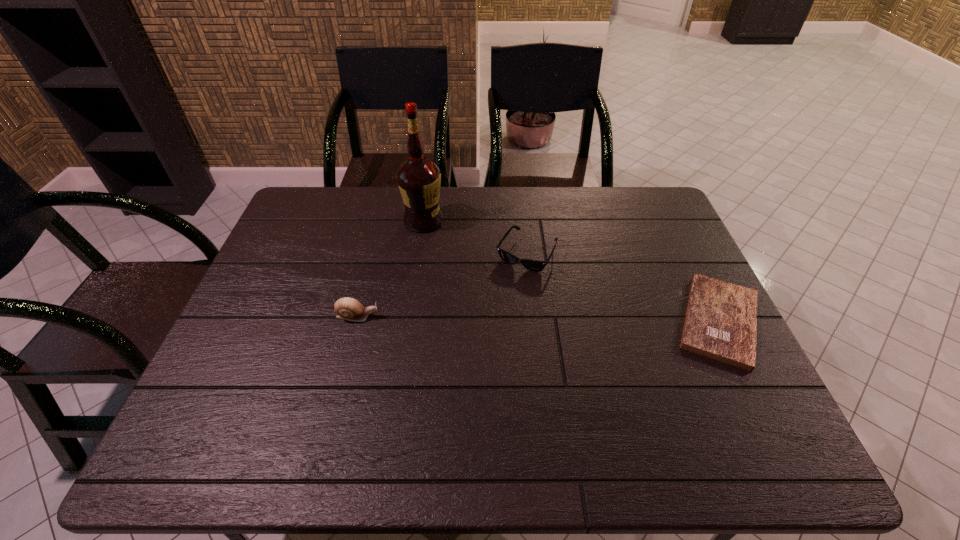
Locate an element on the screen. The height and width of the screenshot is (540, 960). the leftmost object is located at coordinates (347, 308).

Locate an element on the screen. The width and height of the screenshot is (960, 540). the second tallest object is located at coordinates (347, 308).

Where is `Bible`? The image size is (960, 540). Bible is located at coordinates (721, 319).

The image size is (960, 540). Identify the location of the shortest object. (721, 319).

At what (x,y) coordinates should I click in order to perform the action: click on the third tallest object. Please return your answer as a coordinate pair (x, y). The width and height of the screenshot is (960, 540). Looking at the image, I should click on (533, 265).

This screenshot has height=540, width=960. I want to click on the second object from right to left, so click(x=533, y=265).

The image size is (960, 540). In order to click on the third object from right to left in this screenshot , I will do `click(419, 179)`.

Locate an element on the screen. This screenshot has width=960, height=540. the tallest object is located at coordinates (419, 179).

At what (x,y) coordinates should I click in order to perform the action: click on free space located on the front-facing side of the third shortest object. Please return your answer as a coordinate pair (x, y). The height and width of the screenshot is (540, 960). Looking at the image, I should click on (421, 317).

The width and height of the screenshot is (960, 540). Find the location of `vacant space located on the left of the Bible`. vacant space located on the left of the Bible is located at coordinates (522, 321).